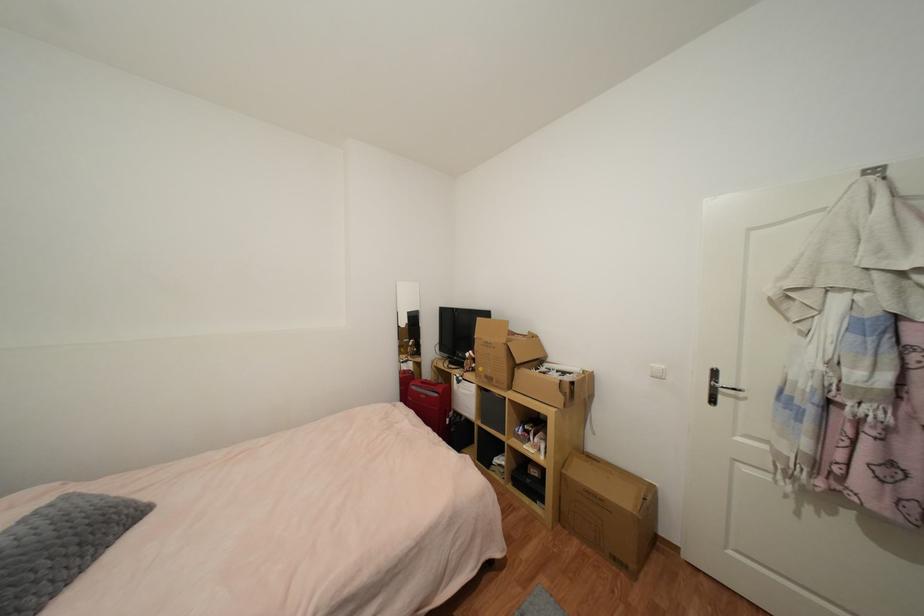
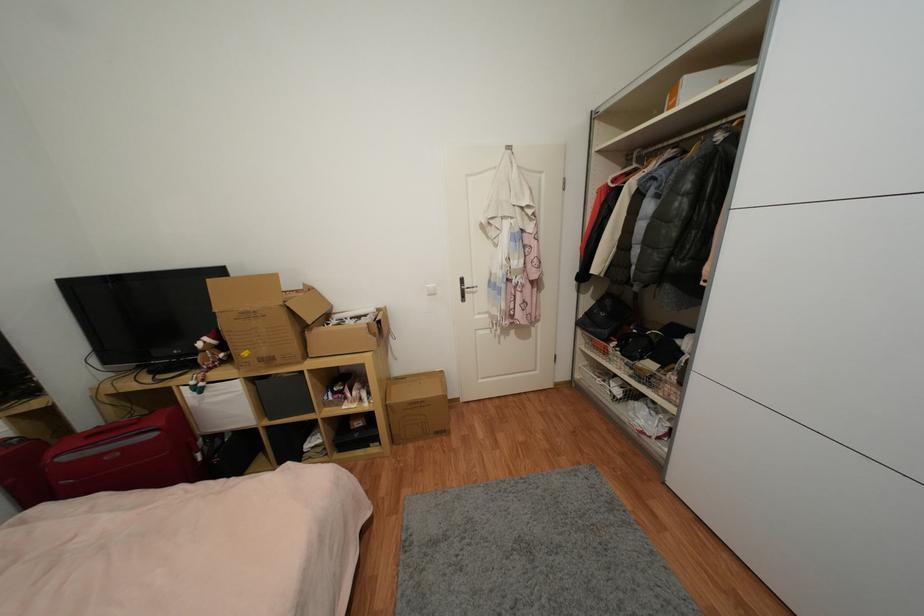
Where in the second image is the point corresponding to [440,397] from the first image?

(157, 436)